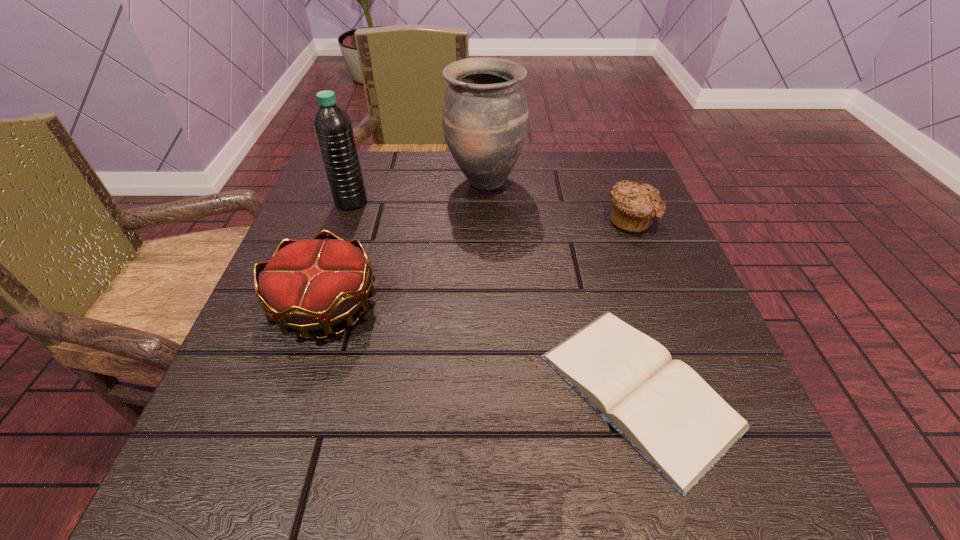
The height and width of the screenshot is (540, 960). Find the location of `object that is at the near right corner`. object that is at the near right corner is located at coordinates (661, 407).

This screenshot has width=960, height=540. I want to click on vacant space at the far edge of the desktop, so click(x=535, y=199).

Where is `vacant region at the near edge of the desktop`? This screenshot has height=540, width=960. vacant region at the near edge of the desktop is located at coordinates (553, 449).

The width and height of the screenshot is (960, 540). I want to click on vacant space at the left edge of the desktop, so click(249, 417).

Identify the location of free region at the right edge. This screenshot has height=540, width=960. (609, 302).

Where is `vacant space at the near left corner of the desktop`? This screenshot has width=960, height=540. vacant space at the near left corner of the desktop is located at coordinates (238, 446).

Where is `vacant space at the near right corner of the desktop`? Image resolution: width=960 pixels, height=540 pixels. vacant space at the near right corner of the desktop is located at coordinates (702, 494).

The image size is (960, 540). I want to click on vacant region between the muffin and the urn, so click(x=558, y=200).

Image resolution: width=960 pixels, height=540 pixels. What are the coordinates of `free point between the urn and the Bible` in the screenshot? It's located at (562, 286).

Locate an element on the screen. This screenshot has height=540, width=960. free space that is in between the second shortest object and the Bible is located at coordinates (636, 305).